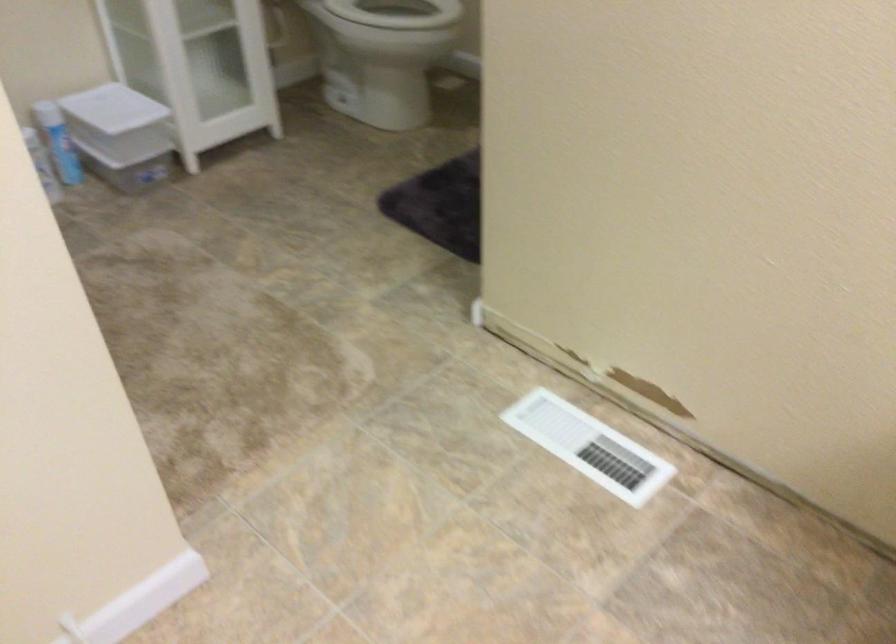
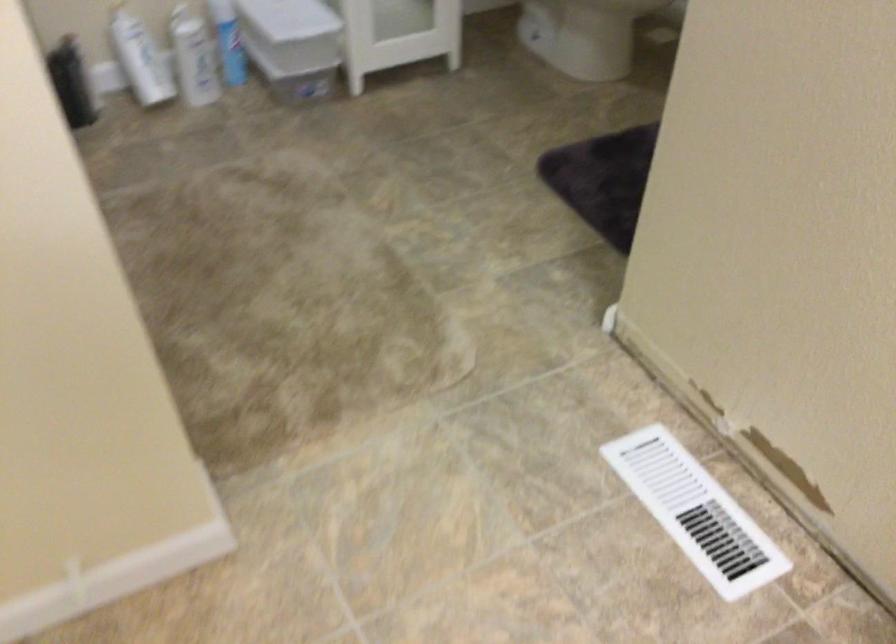
The point at (128, 124) is marked in the first image. Where is the corresponding point in the second image?

(293, 32)